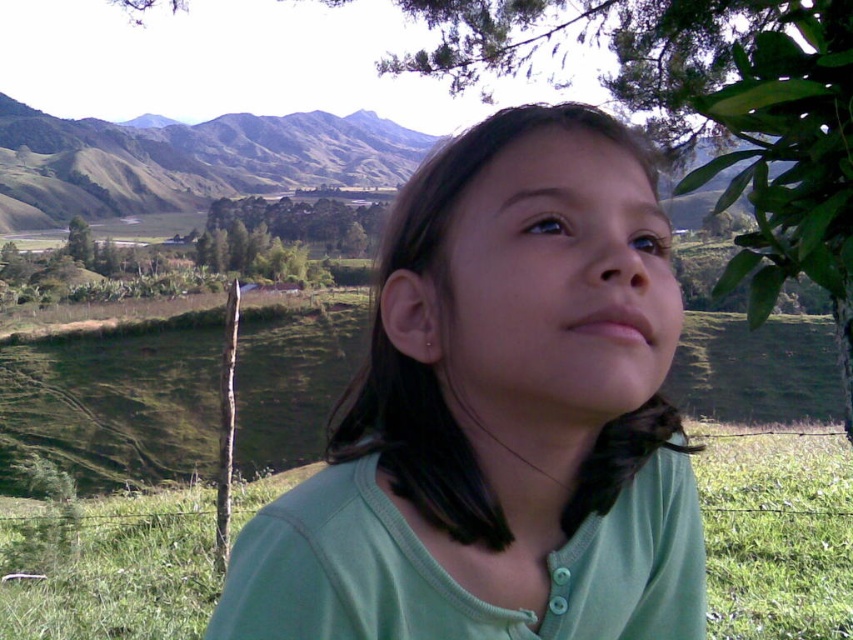
Question: Based on their relative distances, which object is farther from the green leafy tree at upper right?

Choices:
 (A) green leafy tree at center
 (B) green matte shirt at center
 (C) green grassy mountain at upper left

Answer: (C)

Question: Does green matte shirt at center have a greater width compared to green leafy tree at upper right?

Choices:
 (A) yes
 (B) no

Answer: (B)

Question: Does green matte shirt at center appear under green grassy mountain at upper left?

Choices:
 (A) no
 (B) yes

Answer: (B)

Question: Where is green leafy tree at upper right located in relation to green leafy tree at center in the image?

Choices:
 (A) above
 (B) below

Answer: (B)

Question: Which of the following is the closest to the observer?

Choices:
 (A) (231, 243)
 (B) (758, 243)

Answer: (B)

Question: Which of the following is the farthest from the observer?

Choices:
 (A) green leafy tree at center
 (B) green matte shirt at center
 (C) green grassy mountain at upper left
 (D) green leafy tree at upper right

Answer: (C)